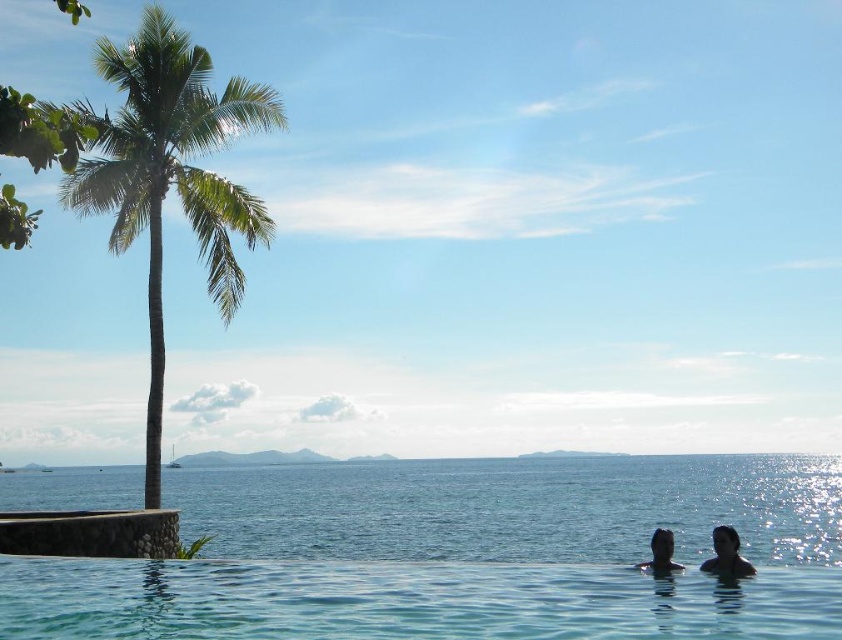
You are a photographer trying to capture a closeup shot of the dark skin human at lower right and the black matte head at lower right. Can you fit both subjects into your camera frame if your camera has a maximum field of view that can accommodate 10 inches width?

The distance between the dark skin human at lower right and the black matte head at lower right is 8.58 inches, which is within the camera frame capacity of 10 inches. Therefore, both subjects can be captured in the same frame.

You are a swimmer who wants to cross from the pool to the ocean. You see the clear blue water at center and the dark skin human at lower right. Which direction should you swim to reach the ocean?

The clear blue water at center is wider than the dark skin human at lower right, so swimming towards the clear blue water at center would lead you towards the ocean as it merges seamlessly with the horizon.

You are standing at the edge of the infinity pool looking out towards the ocean. There is a point marked at coordinates (726, 554). What object or feature does this point correspond to?

The point at coordinates (726, 554) corresponds to the dark skin human at lower right.